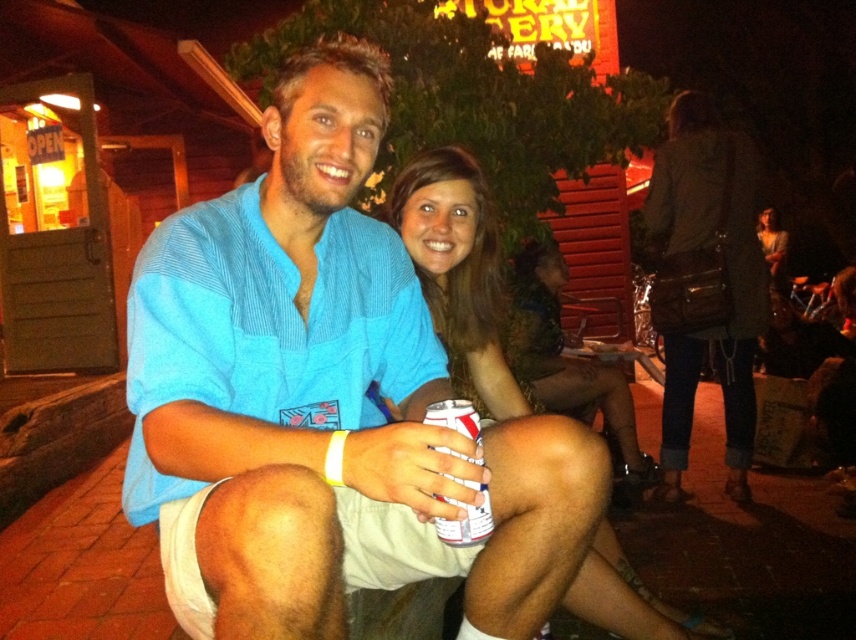
Is blue cotton shirt at center shorter than white matte can at center?

Incorrect, blue cotton shirt at center's height does not fall short of white matte can at center's.

Which is in front, point (308, 76) or point (480, 515)?

Positioned in front is point (480, 515).

Locate an element on the screen. The width and height of the screenshot is (856, 640). blue cotton shirt at center is located at coordinates [x=325, y=385].

Who is taller, blue cotton shirt at center or matte green dress at center?

blue cotton shirt at center is taller.

Can you confirm if blue cotton shirt at center is positioned to the left of matte green dress at center?

Correct, you'll find blue cotton shirt at center to the left of matte green dress at center.

The image size is (856, 640). I want to click on blue cotton shirt at center, so pyautogui.click(x=325, y=385).

Who is positioned more to the right, leather jacket at right or white matte can at center?

leather jacket at right is more to the right.

Does point (672, 362) lie in front of point (456, 422)?

No.

You are a GUI agent. You are given a task and a screenshot of the screen. Output one action in this format:
    pyautogui.click(x=<x>, y=<y>)
    Task: Click on the leather jacket at right
    The width and height of the screenshot is (856, 640).
    Given the screenshot: What is the action you would take?
    pyautogui.click(x=722, y=280)

Where is `leather jacket at right`? This screenshot has height=640, width=856. leather jacket at right is located at coordinates (722, 280).